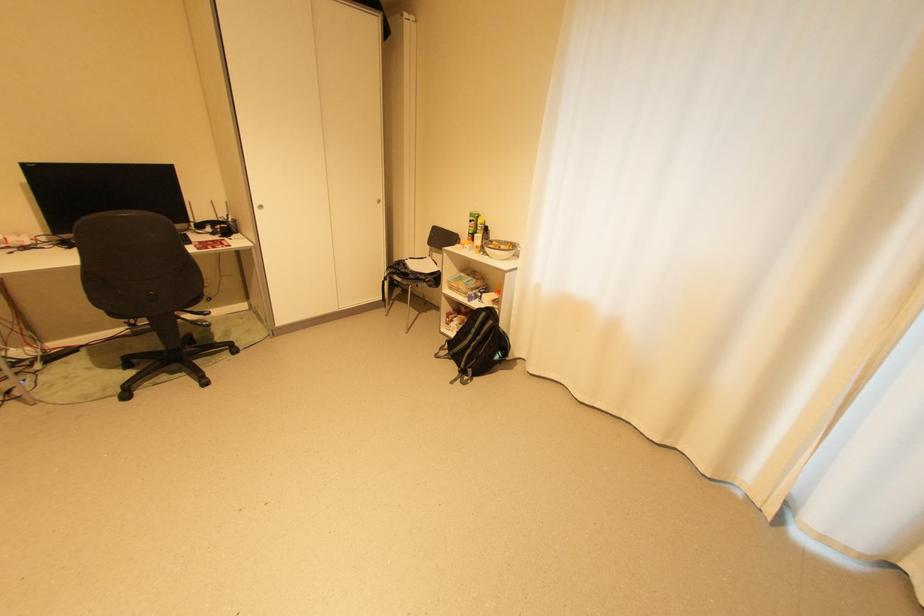
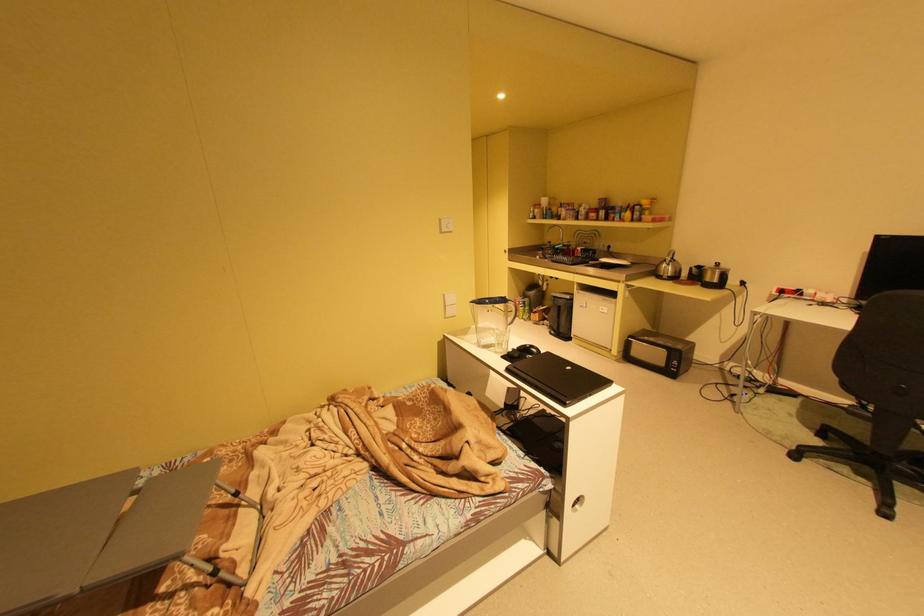
How did the camera likely rotate?

The rotation direction of the camera is left-down.